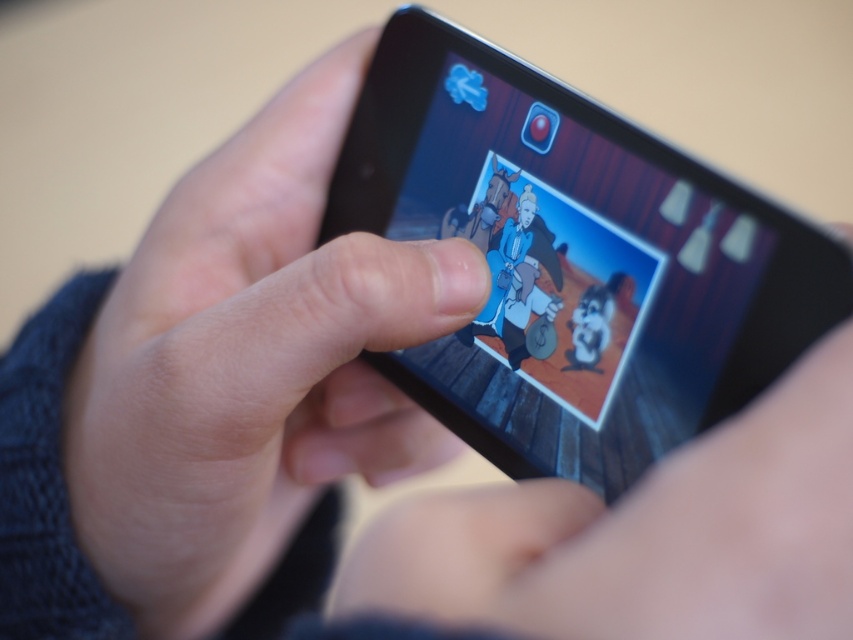
Can you confirm if smooth skin hand at center is wider than black matte smartphone at center?

Indeed, smooth skin hand at center has a greater width compared to black matte smartphone at center.

Does smooth skin hand at center lie in front of black matte smartphone at center?

That is False.

This screenshot has width=853, height=640. Find the location of `smooth skin hand at center`. smooth skin hand at center is located at coordinates (248, 364).

Locate an element on the screen. Image resolution: width=853 pixels, height=640 pixels. smooth skin hand at center is located at coordinates (248, 364).